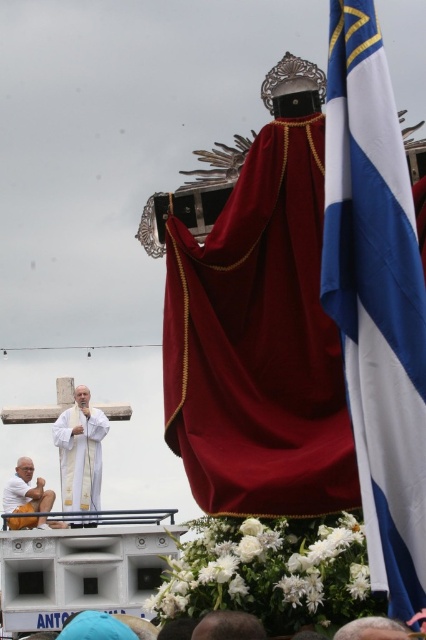
In the religious procession scene, you notice two items on the float at the center. The velvet deep red cape at center and the white satin robe at center. Which one is taller?

The velvet deep red cape at center is much taller than the white satin robe at center.

You are a photographer trying to capture the religious procession. You notice the white satin robe at center and the smooth brown leather hat at lower center. Which object should you focus on if you want to photograph the larger item?

The white satin robe at center is larger in size than the smooth brown leather hat at lower center, so you should focus on the white satin robe at center for the larger item.

You are a photographer trying to capture the religious leader in the white satin robe at center and the statue in the white matte statue at lower left. Which object should you focus on first if you want to photograph them in order from left to right?

The white matte statue at lower left should be focused on first because it is positioned to the left of the white satin robe at center.